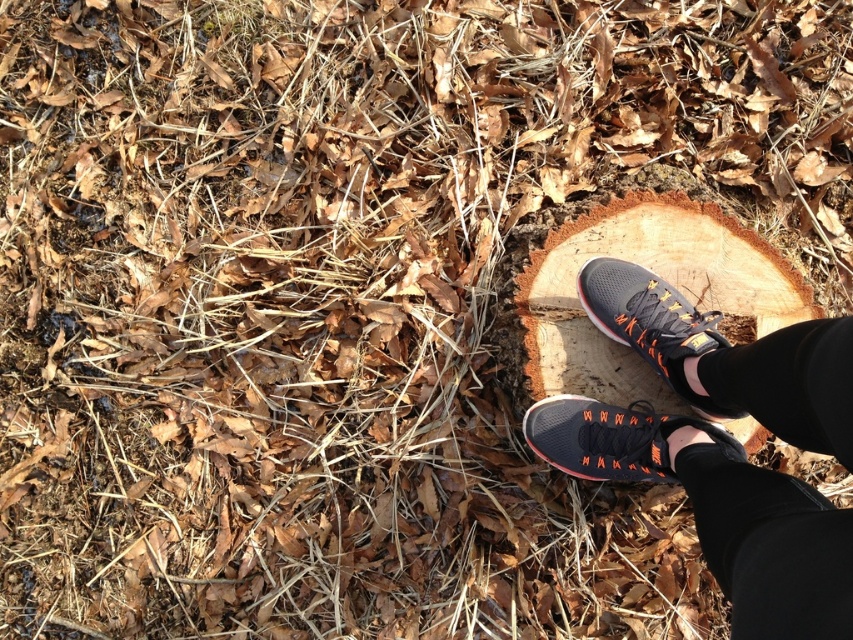
What do you see at coordinates (613, 438) in the screenshot? I see `orange mesh sneaker at lower right` at bounding box center [613, 438].

Which of these two, orange mesh sneaker at lower right or matte black sneaker at center, stands shorter?

With less height is orange mesh sneaker at lower right.

The image size is (853, 640). What do you see at coordinates (613, 438) in the screenshot?
I see `orange mesh sneaker at lower right` at bounding box center [613, 438].

In order to click on orange mesh sneaker at lower right in this screenshot , I will do `click(613, 438)`.

Can you confirm if matte black sneakers at center is positioned above wooden stump at center?

No.

Is point (721, 448) farther from viewer compared to point (776, 276)?

No, it is not.

Does point (775, 632) come farther from viewer compared to point (677, 236)?

No, it is not.

Identify the location of matte black sneakers at center. This screenshot has height=640, width=853. (718, 509).

Who is positioned more to the right, wooden stump at center or matte black sneaker at center?

wooden stump at center is more to the right.

Can you confirm if wooden stump at center is thinner than matte black sneaker at center?

No.

Between point (630, 372) and point (628, 310), which one is positioned in front?

Point (628, 310)

This screenshot has height=640, width=853. Identify the location of wooden stump at center. (660, 276).